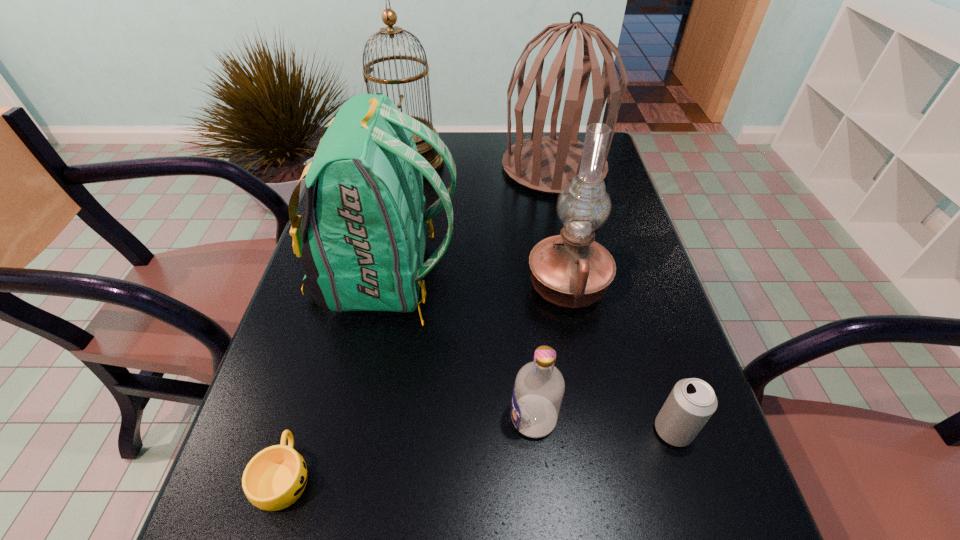
Locate an element on the screen. the left birdcage is located at coordinates (389, 17).

Image resolution: width=960 pixels, height=540 pixels. I want to click on the right birdcage, so click(546, 164).

At what (x,y) coordinates should I click in order to perform the action: click on backpack. Please return your answer as a coordinate pair (x, y). Looking at the image, I should click on (364, 250).

At what (x,y) coordinates should I click in order to perform the action: click on oil lamp. Please return your answer as a coordinate pair (x, y). The image size is (960, 540). Looking at the image, I should click on (571, 270).

This screenshot has height=540, width=960. I want to click on the third shortest object, so click(538, 390).

At what (x,y) coordinates should I click in order to perform the action: click on the sixth tallest object. Please return your answer as a coordinate pair (x, y). The width and height of the screenshot is (960, 540). Looking at the image, I should click on (691, 403).

The width and height of the screenshot is (960, 540). I want to click on the shortest object, so click(275, 477).

Where is `vacant region located 0.320m with an open door on the left birdcage`? The width and height of the screenshot is (960, 540). vacant region located 0.320m with an open door on the left birdcage is located at coordinates (548, 163).

Identify the location of vacant region located 0.060m on the left of the right birdcage. This screenshot has height=540, width=960. (482, 167).

Identify the location of vacant space located on the back of the backpack. Image resolution: width=960 pixels, height=540 pixels. (528, 277).